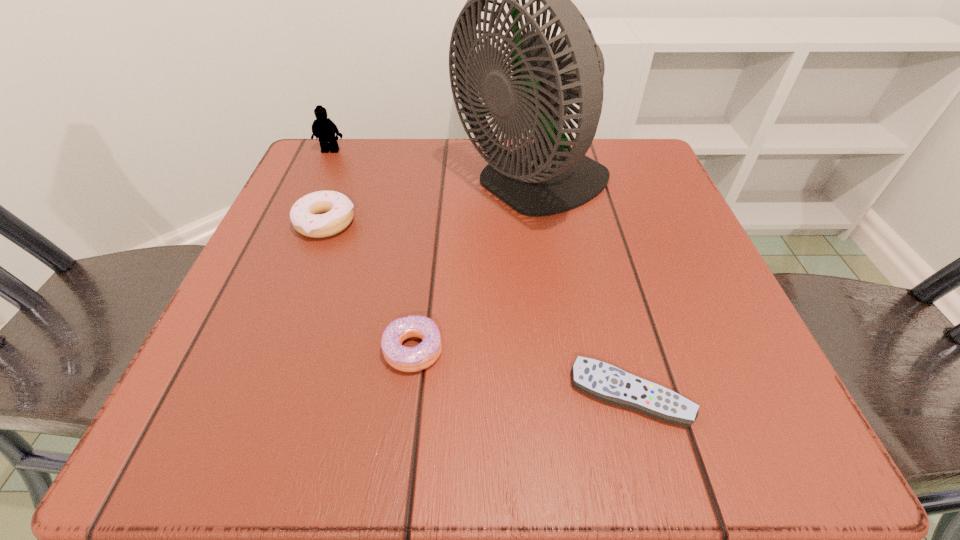
Find the location of a particular element. The height and width of the screenshot is (540, 960). object present at the far right corner is located at coordinates (546, 177).

Where is `object that is positioned at the near right corner`? This screenshot has width=960, height=540. object that is positioned at the near right corner is located at coordinates (603, 381).

Locate an element on the screen. This screenshot has height=540, width=960. vacant area at the far edge is located at coordinates (464, 158).

At what (x,y) coordinates should I click in order to perform the action: click on vacant area at the near edge of the desktop. Please return your answer as a coordinate pair (x, y). This screenshot has height=540, width=960. Looking at the image, I should click on (487, 410).

Identify the location of vacant space at the left edge. This screenshot has height=540, width=960. (291, 366).

Where is `vacant region at the right edge of the desktop`? The width and height of the screenshot is (960, 540). vacant region at the right edge of the desktop is located at coordinates (655, 223).

At what (x,y) coordinates should I click in order to perform the action: click on vacant region at the far left corner of the desktop. Please return your answer as a coordinate pair (x, y). The width and height of the screenshot is (960, 540). Looking at the image, I should click on (376, 145).

This screenshot has height=540, width=960. Identify the location of free spot at the far right corner of the desktop. (633, 166).

Identify the location of empty space between the tallest object and the nearer doughnut. Image resolution: width=960 pixels, height=540 pixels. (473, 268).

The height and width of the screenshot is (540, 960). What are the coordinates of `free space that is in between the farther doughnut and the nearer doughnut` in the screenshot? It's located at (370, 286).